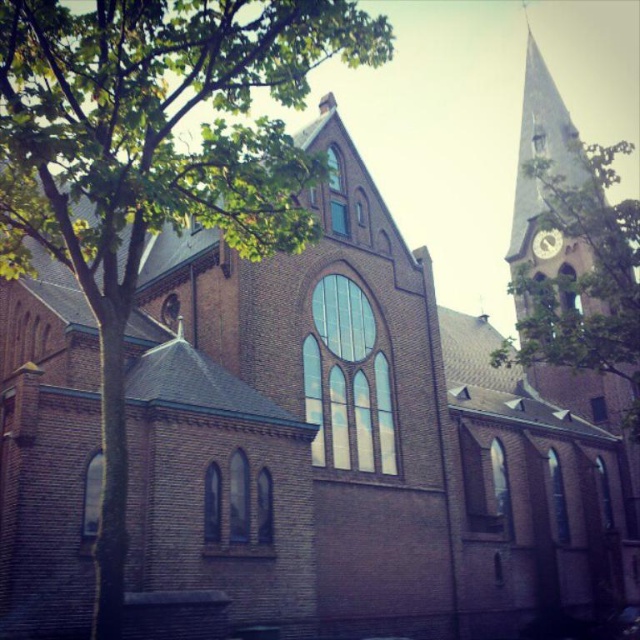
Question: Which point is closer to the camera taking this photo?

Choices:
 (A) (563, 180)
 (B) (538, 237)

Answer: (A)

Question: Which point is closer to the camera taking this photo?

Choices:
 (A) (65, 196)
 (B) (552, 256)
 (C) (557, 179)

Answer: (A)

Question: Does light pink stone clock tower at upper right appear over metallic silver clock at upper right?

Choices:
 (A) yes
 (B) no

Answer: (A)

Question: Can you confirm if green leafy tree at left is positioned below light pink stone clock tower at upper right?

Choices:
 (A) no
 (B) yes

Answer: (A)

Question: Considering the relative positions of green leafy tree at left and metallic silver clock at upper right in the image provided, where is green leafy tree at left located with respect to metallic silver clock at upper right?

Choices:
 (A) right
 (B) left

Answer: (B)

Question: Which object is positioned closest to the metallic silver clock at upper right?

Choices:
 (A) light pink stone clock tower at upper right
 (B) green leafy tree at left

Answer: (A)